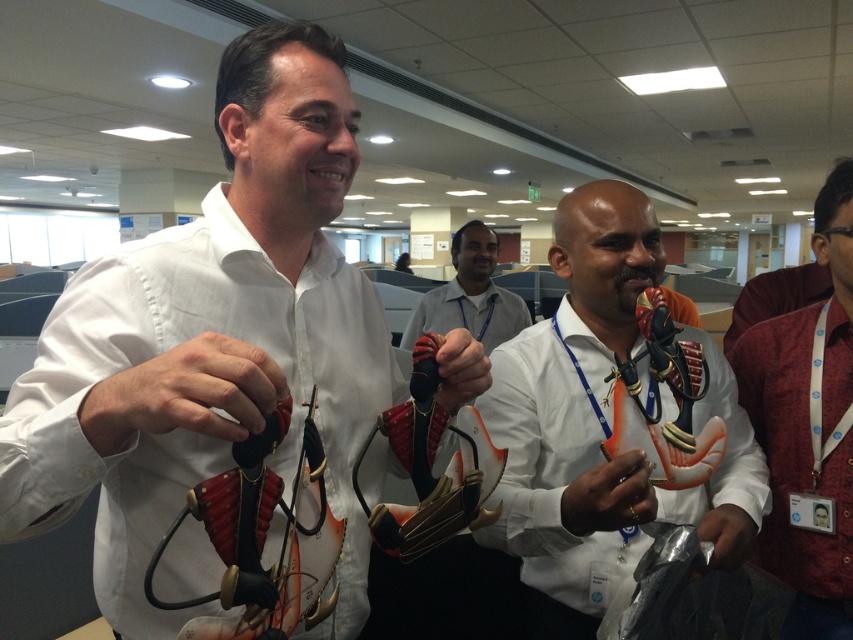
Is white matte shirt at center positioned at the back of matte black object at center?

Yes.

Is white matte shirt at center in front of matte black object at center?

No.

Is point (152, 253) farther from viewer compared to point (206, 429)?

That is True.

This screenshot has height=640, width=853. Find the location of `white matte shirt at center`. white matte shirt at center is located at coordinates (212, 339).

Does matte white shirt at center appear over metallic gray glove at lower right?

Yes.

In the scene shown: Does matte white shirt at center lie behind metallic gray glove at lower right?

Yes, matte white shirt at center is behind metallic gray glove at lower right.

This screenshot has width=853, height=640. I want to click on matte white shirt at center, so click(x=469, y=296).

Does orange matte anatomical model at center have a smaller size compared to red textured shirt at right?

Incorrect, orange matte anatomical model at center is not smaller in size than red textured shirt at right.

Is point (653, 266) farther from viewer compared to point (828, 624)?

No.

Where is `orange matte anatomical model at center`? orange matte anatomical model at center is located at coordinates (553, 460).